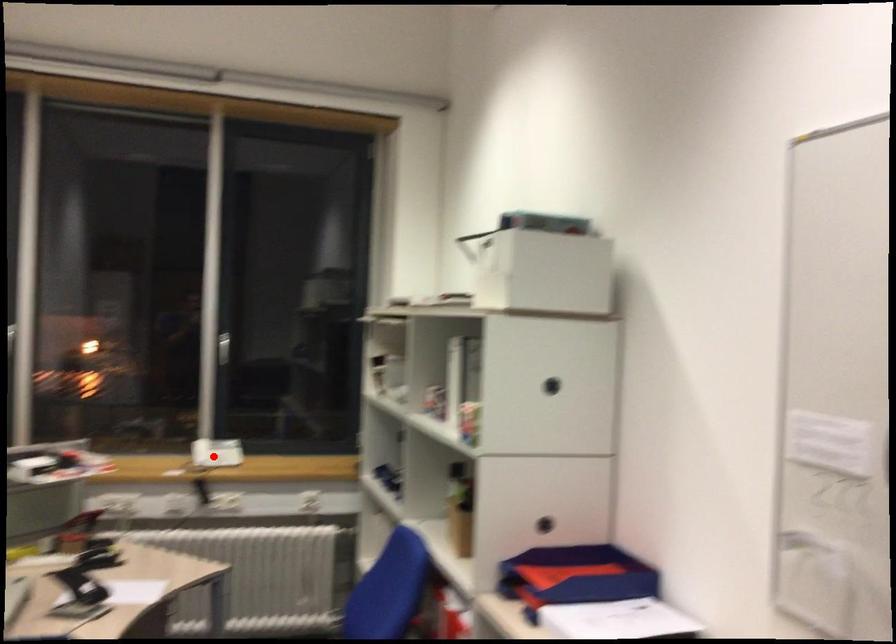
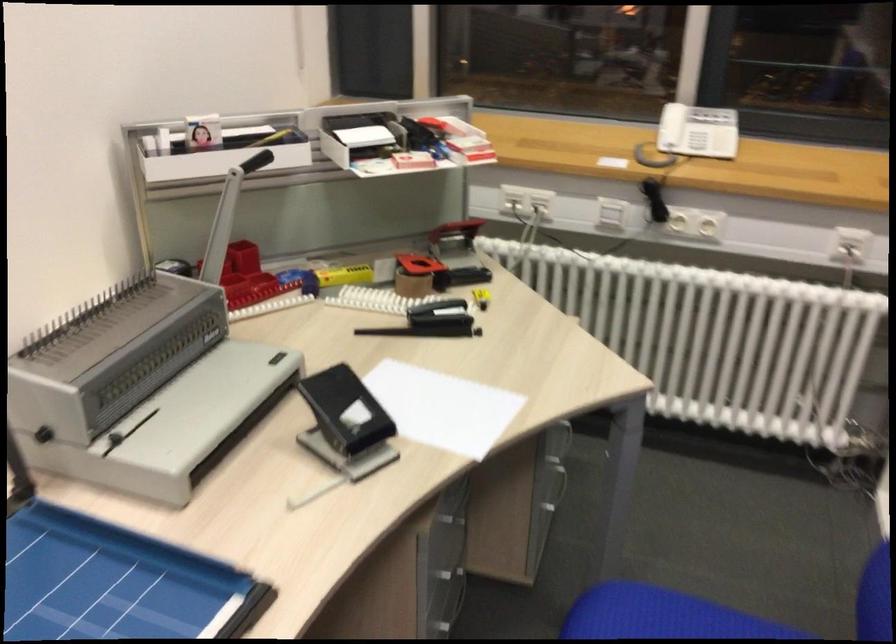
Question: I am providing you with two images of the same scene from different viewpoints. A red point is shown in image1. For the corresponding object point in image2, is it positioned nearer or farther from the camera?

Choices:
 (A) Nearer
 (B) Farther

Answer: (A)